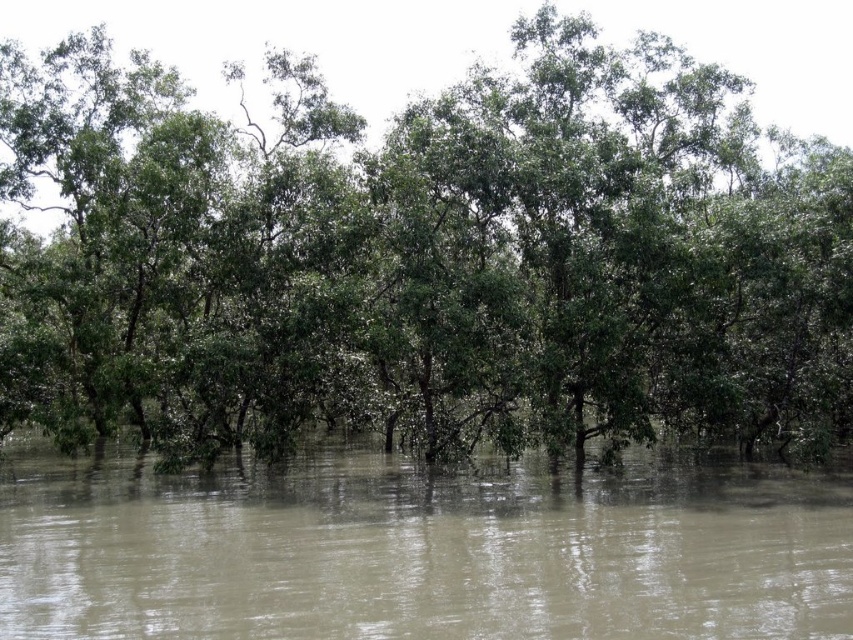
You are standing at the point with coordinates point (674, 534) and want to see the point with coordinates point (166, 314). Can you see it without moving? Please explain your reasoning based on the scene description.

Point (166, 314) is behind point (674, 534), so you cannot see it without moving because it is obscured by the dense vegetation and submerged trees in between.

You are a hiker who needs to cross the flooded area. You see the green leafy trees at center and the brown muddy water at center. Which direction should you head to avoid the water first?

The green leafy trees at center is positioned on the left side of brown muddy water at center, so heading towards the left side of the green leafy trees at center would avoid the brown muddy water at center first.

You are standing at the edge of the flooded area and see the point at coordinates point (585, 300). You want to throw a lifebuoy to someone in the water who is exactly at that point. If the lifebuoy can travel 20 meters, will it reach them?

The distance of point (585, 300) from viewer is 16.50 meters, so yes, the lifebuoy can reach them since 16.50 meters is within the 20 meters range.